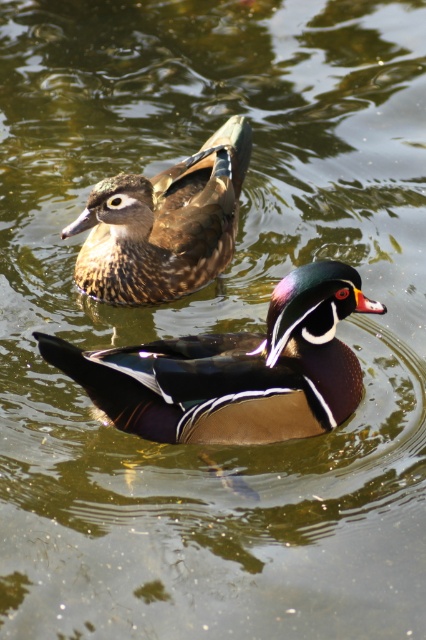
Question: Can you confirm if shiny brown duck at center is wider than brown speckled wood duck at upper left?

Choices:
 (A) no
 (B) yes

Answer: (B)

Question: Which point is closer to the camera?

Choices:
 (A) (279, 301)
 (B) (111, 228)

Answer: (A)

Question: Does shiny brown duck at center have a greater width compared to brown speckled wood duck at upper left?

Choices:
 (A) yes
 (B) no

Answer: (A)

Question: Among these points, which one is farthest from the camera?

Choices:
 (A) (178, 428)
 (B) (158, 273)

Answer: (B)

Question: Is shiny brown duck at center in front of brown speckled wood duck at upper left?

Choices:
 (A) no
 (B) yes

Answer: (B)

Question: Which point is closer to the camera taking this photo?

Choices:
 (A) coord(189,241)
 (B) coord(103,401)

Answer: (B)